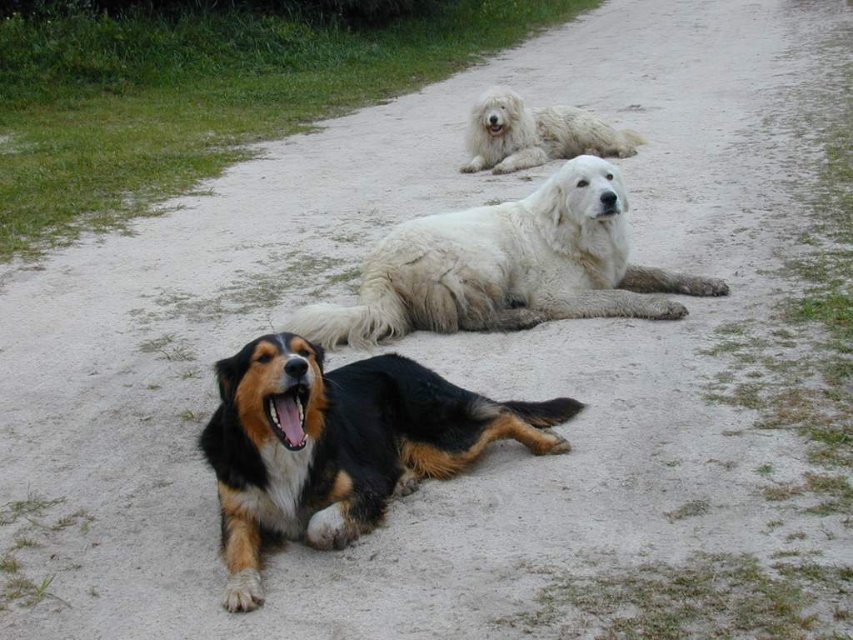
Does point (349, 371) come farther from viewer compared to point (592, 221)?

No, it is in front of (592, 221).

Is tri-colored fur dog at center thinner than white fluffy dog at center?

Yes.

What are the coordinates of `tri-colored fur dog at center` in the screenshot? It's located at (340, 444).

Does white fluffy dog at center have a lesser width compared to white fluffy dog at upper center?

Incorrect, white fluffy dog at center's width is not less than white fluffy dog at upper center's.

Consider the image. Can you confirm if white fluffy dog at center is positioned to the right of white fluffy dog at upper center?

In fact, white fluffy dog at center is to the left of white fluffy dog at upper center.

What do you see at coordinates (506, 268) in the screenshot? This screenshot has height=640, width=853. I see `white fluffy dog at center` at bounding box center [506, 268].

The width and height of the screenshot is (853, 640). What are the coordinates of `white fluffy dog at center` in the screenshot? It's located at click(x=506, y=268).

Can you confirm if tri-colored fur dog at center is positioned to the right of white fluffy dog at upper center?

In fact, tri-colored fur dog at center is to the left of white fluffy dog at upper center.

You are a GUI agent. You are given a task and a screenshot of the screen. Output one action in this format:
    pyautogui.click(x=<x>, y=<y>)
    Task: Click on the tri-colored fur dog at center
    
    Given the screenshot: What is the action you would take?
    pyautogui.click(x=340, y=444)